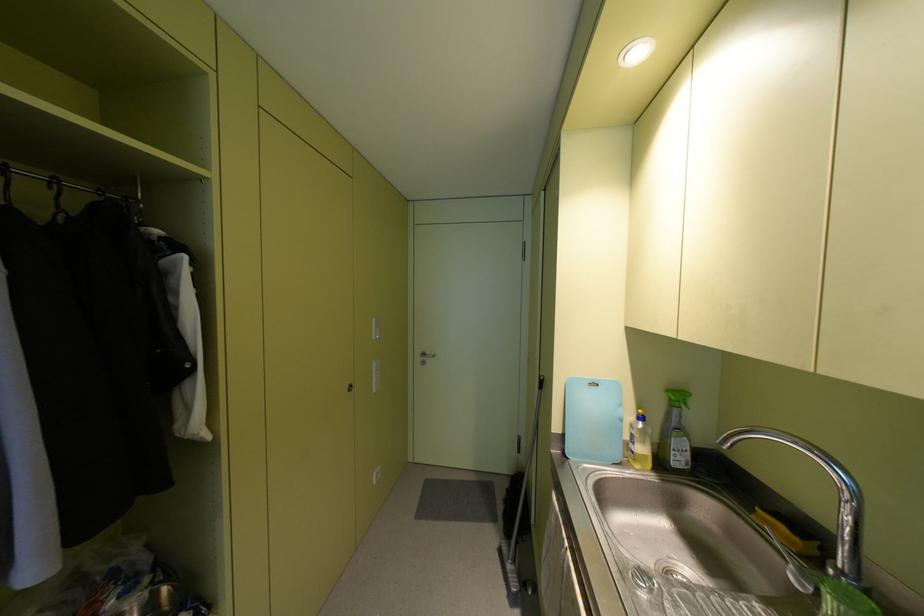
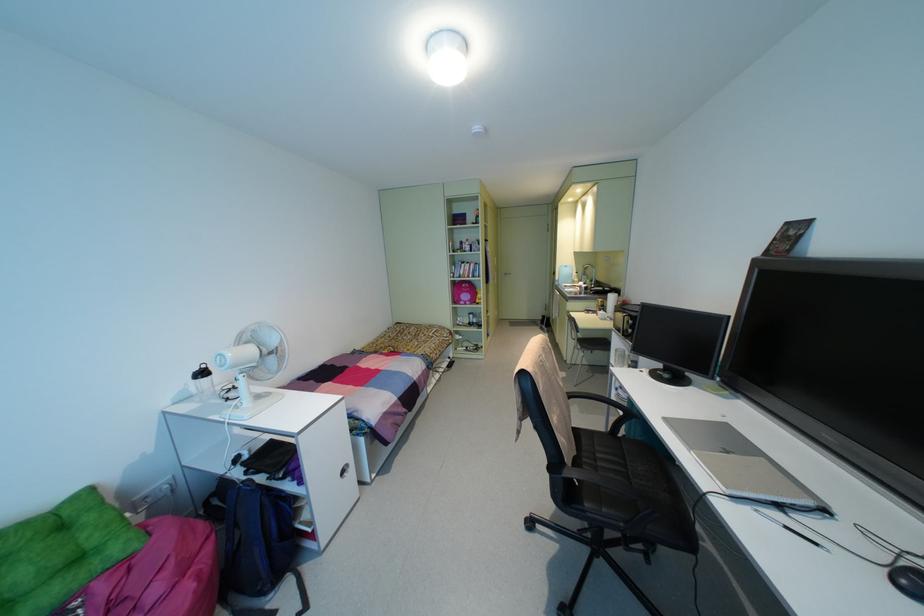
Question: The images are taken continuously from a first-person perspective. In which direction are you moving?

Choices:
 (A) Left
 (B) Right
 (C) Forward
 (D) Backward

Answer: (D)